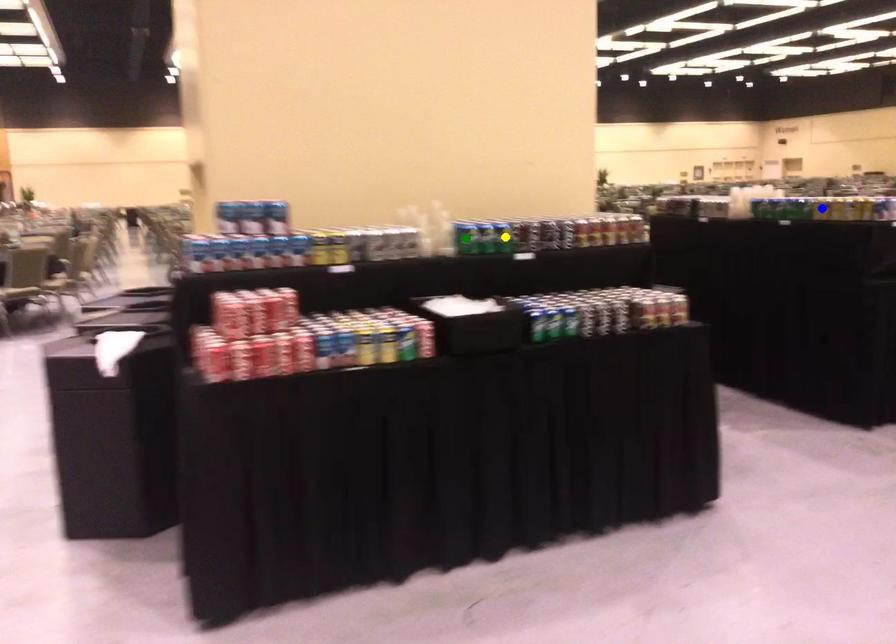
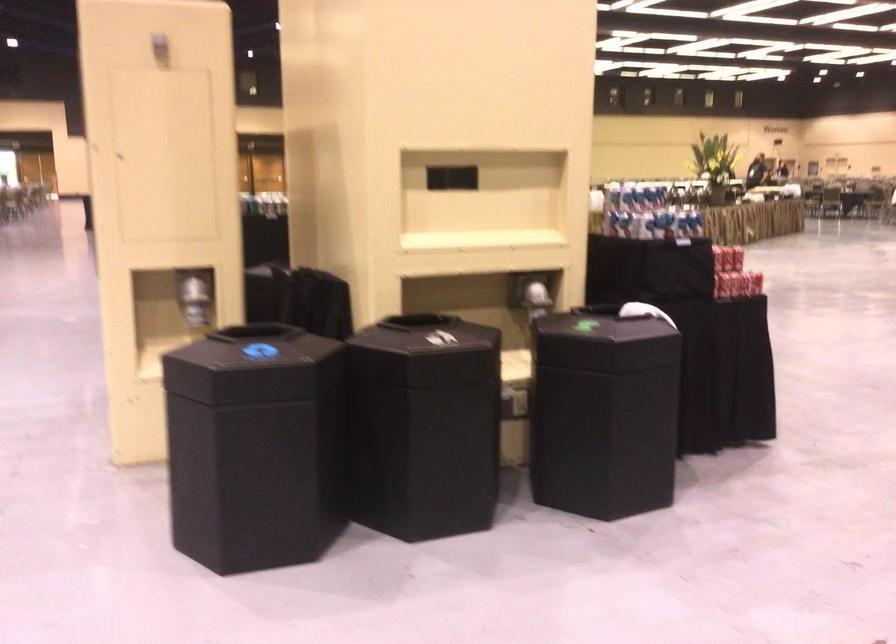
I am providing you with two images of the same scene from different viewpoints. Three points are marked in image1. Which point corresponds to a part or object that is occluded in image2?In image1, three points are marked. Which of them correspond to a part or object that is occluded in image2?Among the three points shown in image1, which one corresponds to a part or object that is no longer visible due to occlusion in image2?

green point, yellow point, blue point cannot be seen in image2.